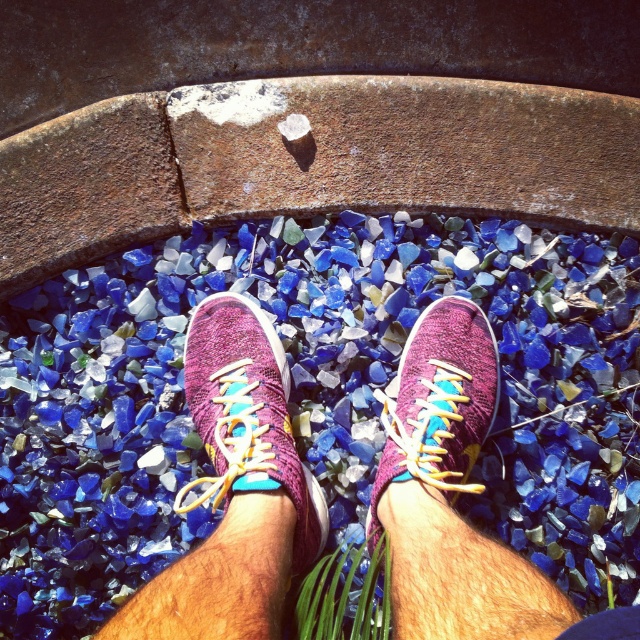
You are a delivery person trying to pack two pairs of sneakers into a box. The box can only fit one pair. You have the pink knitted sneakers at center and the knit fabric sneaker at center. Which pair should you choose to ensure it fits?

The pink knitted sneakers at center has a larger size compared to knit fabric sneaker at center, so you should choose the knit fabric sneaker at center to ensure it fits in the box.

Looking at this image, you are a fashion designer trying to pair two different shoes for a photoshoot. You have a knitted purple shoe at center and a knit fabric sneaker at center. Which shoe should you choose if you want the one that is bigger in size?

The knitted purple shoe at center has a larger size compared to the knit fabric sneaker at center, so you should choose the knitted purple shoe at center for the photoshoot.

What are the coordinates of the pink knitted sneakers at center?

The pink knitted sneakers at center are located at coordinates point (234, 490).